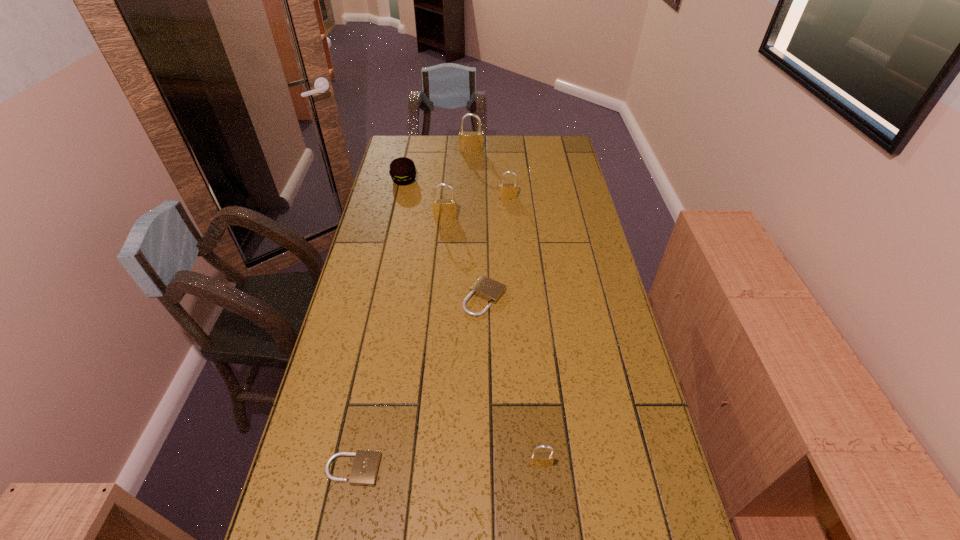
This screenshot has height=540, width=960. I want to click on free space between the third nearest brass padlock and the fourth farthest padlock, so click(x=496, y=247).

Locate an element on the screen. Image resolution: width=960 pixels, height=540 pixels. vacant point located between the third nearest object and the fourth farthest object is located at coordinates click(x=465, y=258).

This screenshot has width=960, height=540. In order to click on unoccupied area between the shortest object and the second tallest padlock in this screenshot , I will do `click(399, 343)`.

I want to click on free space between the farthest brass padlock and the right beige padlock, so click(478, 224).

Locate an element on the screen. The height and width of the screenshot is (540, 960). object that is the fifth closest to the nearest brass padlock is located at coordinates (402, 170).

Locate an element on the screen. This screenshot has width=960, height=540. the fifth closest object to the farther beige padlock is located at coordinates (402, 170).

Image resolution: width=960 pixels, height=540 pixels. What are the coordinates of `the fourth closest padlock to the fourth tallest padlock` in the screenshot? It's located at (507, 191).

Locate an element on the screen. The height and width of the screenshot is (540, 960). padlock that is the second closest one to the patty is located at coordinates (469, 142).

Choose which brass padlock is the nearest neighbor to the farthest object. Please provide its 2D coordinates. Your answer should be formatted as a tuple, i.e. [(x, y)], where the tuple contains the x and y coordinates of a point satisfying the conditions above.

[(507, 191)]

Identify which brass padlock is the third nearest to the nearer beige padlock. Please provide its 2D coordinates. Your answer should be formatted as a tuple, i.e. [(x, y)], where the tuple contains the x and y coordinates of a point satisfying the conditions above.

[(507, 191)]